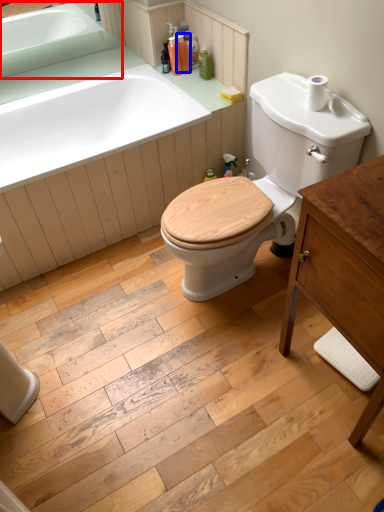
Question: Which object appears farthest to the camera in this image, sink (highlighted by a red box) or toiletry (highlighted by a blue box)?

Choices:
 (A) sink
 (B) toiletry

Answer: (B)